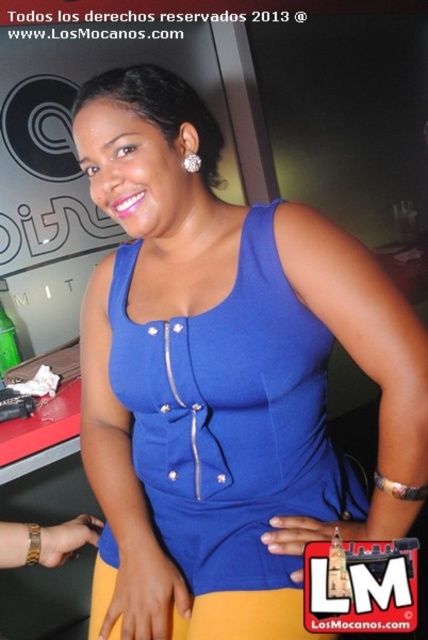
You are a photographer who wants to capture the woman in the center of the frame. The green glass bottle at left is currently blocking part of her left side. Can you move the bottle to a position where it won

The green glass bottle at left is located at point (8, 342). Moving it to a position with an x coordinate less than 0.537 would place it further to the left, away from the woman, thus not blocking her left side anymore.

You are a photographer adjusting your camera settings. You notice the blue fabric dress at center and the diamondelegantearring at upper left in your viewfinder. Which object should you focus on to ensure it appears sharp if the other is slightly out of focus?

You should focus on the blue fabric dress at center because it is closer to the viewer than the diamondelegantearring at upper left, so focusing on the closer object will keep it sharp while the distant one may blur.

You are a photographer setting up for a photoshoot. You notice the blue fabric dress at center and the green glass bottle at left in the scene. From the photographer perspective, which object is positioned lower in the frame?

The blue fabric dress at center is located below the green glass bottle at left, so it is positioned lower in the frame.